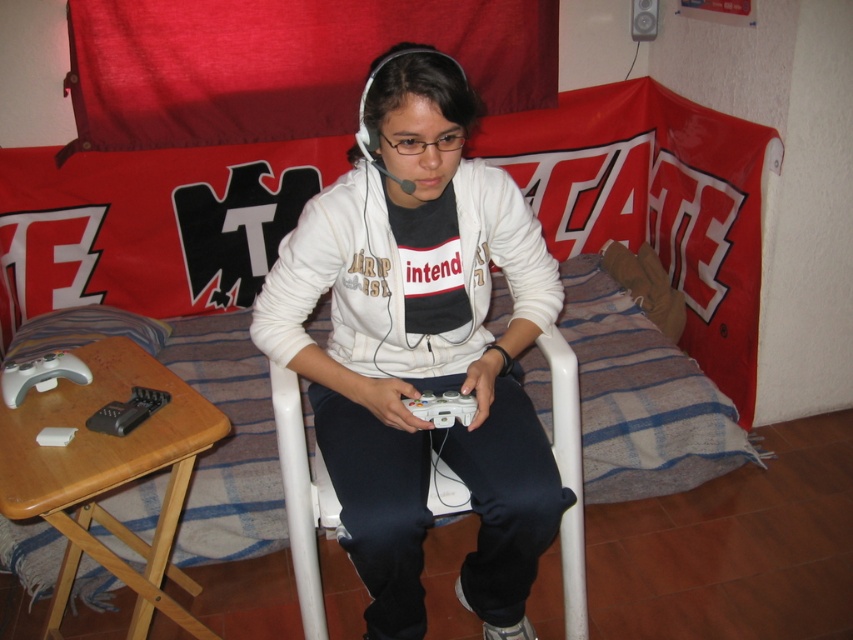
You are trying to determine which game controller is more suitable for your child who has small hands. The white matte game controller at left and the white matte game controller at lower center are both available. Based on the image, which one would you choose?

The white matte game controller at lower center is smaller in size than the white matte game controller at left, so it would be more suitable for a child with small hands.